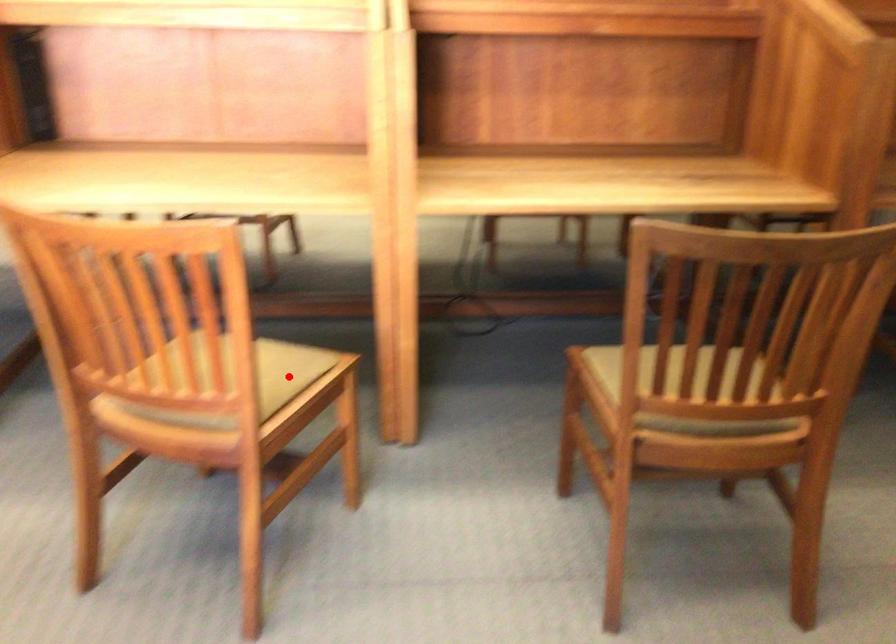
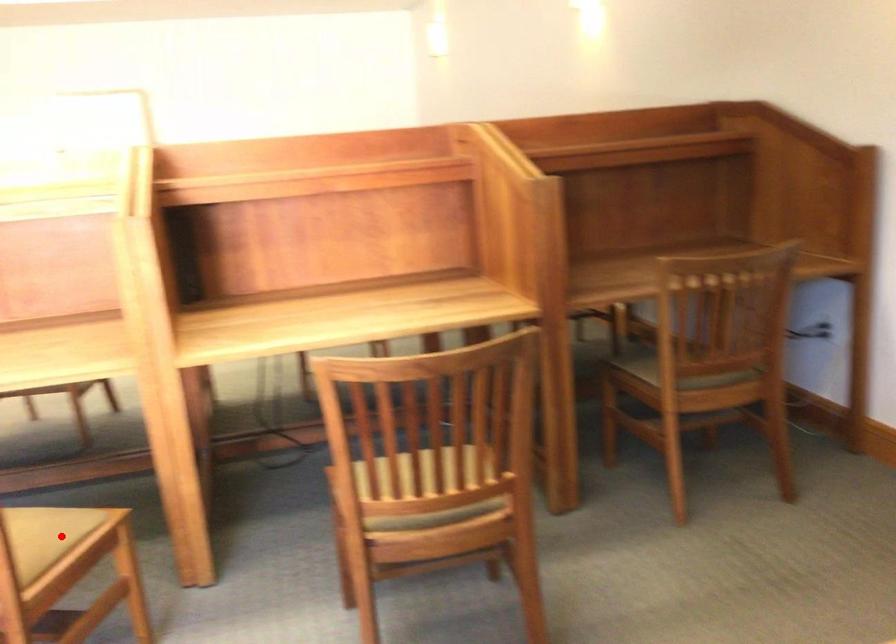
Looking at this image, I am providing you with two images of the same scene from different viewpoints. A red point is marked on the first image and another point is marked on the second image. Are the points marked in image1 and image2 representing the same 3D position?

Yes